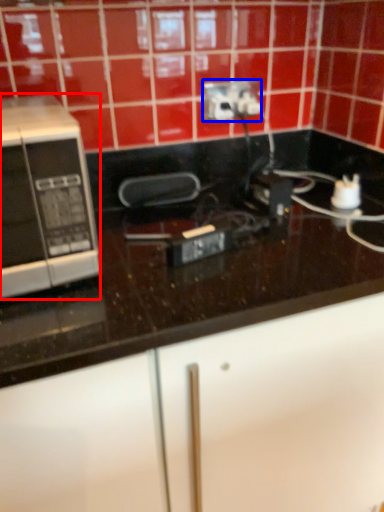
Question: Among these objects, which one is farthest to the camera, microwave oven (highlighted by a red box) or power plugs and sockets (highlighted by a blue box)?

Choices:
 (A) microwave oven
 (B) power plugs and sockets

Answer: (B)